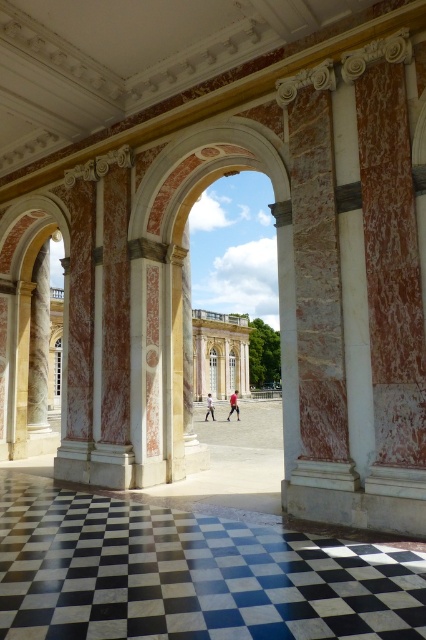
You are a dancer wearing the red fabric pants at center and want to ensure you have enough space to perform a wide, sweeping movement. Based on the scene, can you determine if the black marble floor at center provides sufficient width for your movement?

The black marble floor at center might be wider than red fabric pants at center, so there is a possibility that the floor has enough width to accommodate your sweeping movement. However, without exact measurements, it is uncertain. You should test the space carefully.

You are a delivery person carrying a large box and need to place it on the floor. The black marble floor at center and the light brown leather jacket at center are both in your line of sight. Which object should you target to place the box without disturbing the jacket?

You should target the black marble floor at center to place the box because the light brown leather jacket at center is 98.98 feet away from it, meaning the jacket is far from the floor and the box can be safely placed on the floor without disturbing the jacket.

You are an interior designer arranging a photoshoot in the colonnade. You have two items to position properly. The red fabric pants at center and the light brown leather jacket at center. According to the scene description, which item is positioned to the right of the other?

The red fabric pants at center are to the right of the light brown leather jacket at center.